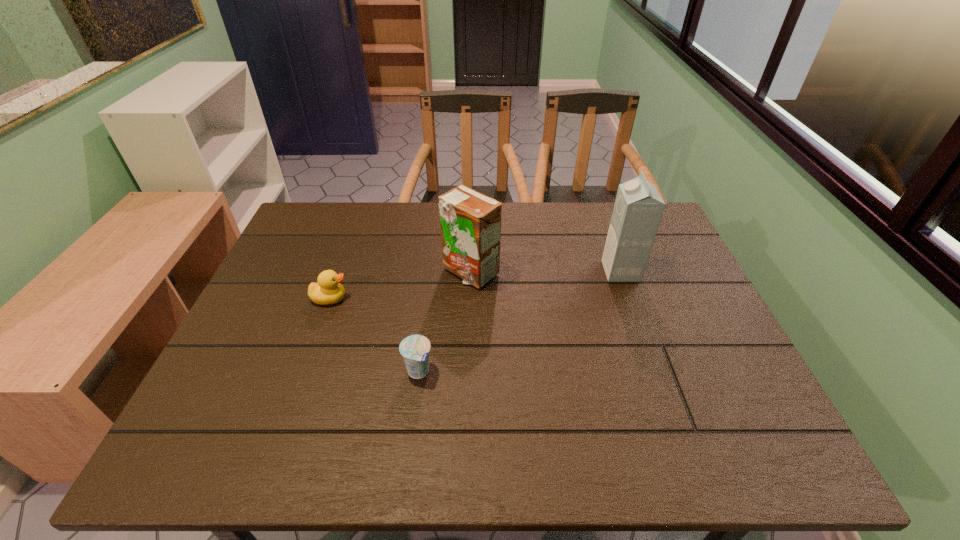
The width and height of the screenshot is (960, 540). I want to click on vacant space that is in between the duck and the second tallest object, so click(x=400, y=285).

Locate which object ranks in proximity to the duck. Please provide its 2D coordinates. Your answer should be formatted as a tuple, i.e. [(x, y)], where the tuple contains the x and y coordinates of a point satisfying the conditions above.

[(470, 222)]

Select which object is the third closest to the nearest object. Please provide its 2D coordinates. Your answer should be formatted as a tuple, i.e. [(x, y)], where the tuple contains the x and y coordinates of a point satisfying the conditions above.

[(638, 208)]

I want to click on vacant point that satisfies the following two spatial constraints: 1. on the straw side of the shorter carton; 2. at the beak of the duck, so pos(469,299).

Where is `free space that satisfies the following two spatial constraints: 1. at the beak of the duck; 2. on the left side of the nearest object`? This screenshot has width=960, height=540. free space that satisfies the following two spatial constraints: 1. at the beak of the duck; 2. on the left side of the nearest object is located at coordinates (303, 372).

Where is `vacant area in the image that satisfies the following two spatial constraints: 1. on the straw side of the left carton; 2. at the beak of the leftmost object`? vacant area in the image that satisfies the following two spatial constraints: 1. on the straw side of the left carton; 2. at the beak of the leftmost object is located at coordinates (469, 299).